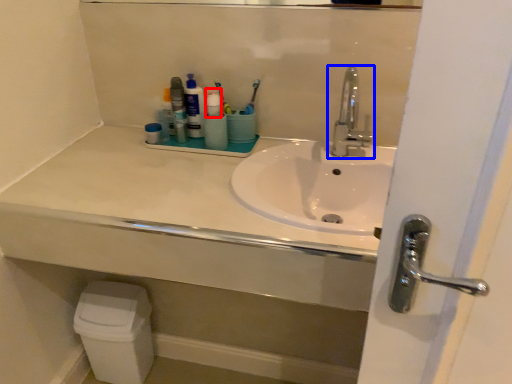
Question: Which point is closer to the camera, toiletry (highlighted by a red box) or tap (highlighted by a blue box)?

Choices:
 (A) toiletry
 (B) tap

Answer: (B)